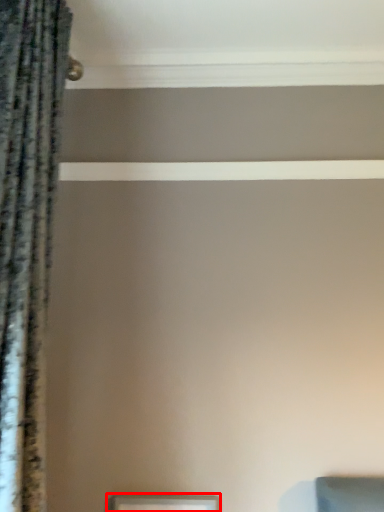
Question: In this image, where is picture frame (annotated by the red box) located relative to curtain?

Choices:
 (A) right
 (B) left

Answer: (A)